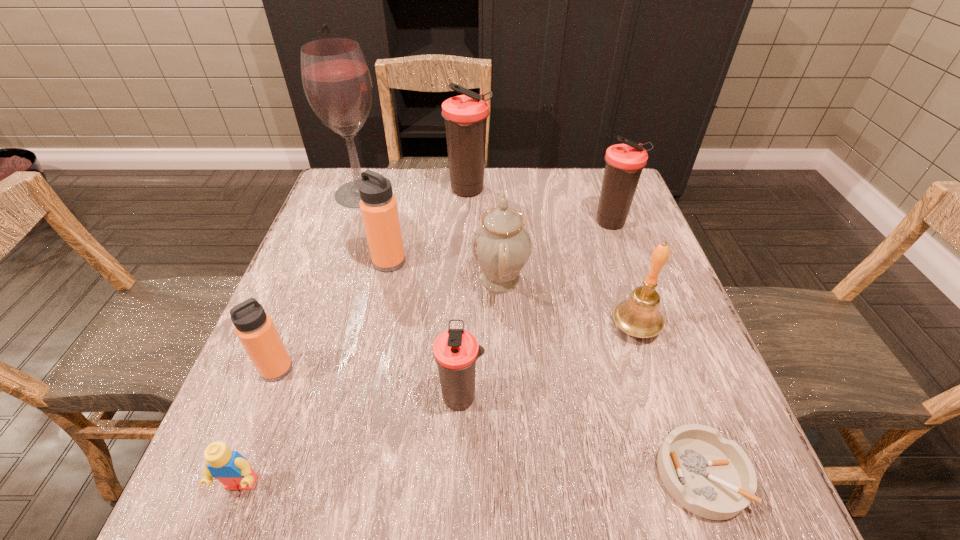
In the image, there is a desktop. At what (x,y) coordinates should I click in order to perform the action: click on blank space at the far edge. Please return your answer as a coordinate pair (x, y). This screenshot has width=960, height=540. Looking at the image, I should click on (487, 191).

This screenshot has height=540, width=960. I want to click on vacant region at the near edge of the desktop, so click(x=392, y=512).

I want to click on vacant area at the left edge of the desktop, so click(x=303, y=356).

The height and width of the screenshot is (540, 960). Identify the location of free point at the right edge. (595, 245).

Image resolution: width=960 pixels, height=540 pixels. I want to click on vacant space at the far left corner of the desktop, so click(x=345, y=174).

In order to click on vacant region at the far right corner in this screenshot , I will do `click(588, 167)`.

You are a GUI agent. You are given a task and a screenshot of the screen. Output one action in this format:
    pyautogui.click(x=<x>, y=<y>)
    Task: Click on the empty location between the ashtray and the rightmost thermos bottle
    Image resolution: width=960 pixels, height=540 pixels.
    Given the screenshot: What is the action you would take?
    pyautogui.click(x=657, y=349)

Image resolution: width=960 pixels, height=540 pixels. Identify the location of vacant space that is in between the red alcohol and the shortest object. (531, 334).

I want to click on vacant region between the shortest object and the bell, so click(668, 401).

Where is `free spot between the second thermos bottle from left to right and the ashtray`? Image resolution: width=960 pixels, height=540 pixels. free spot between the second thermos bottle from left to right and the ashtray is located at coordinates (545, 368).